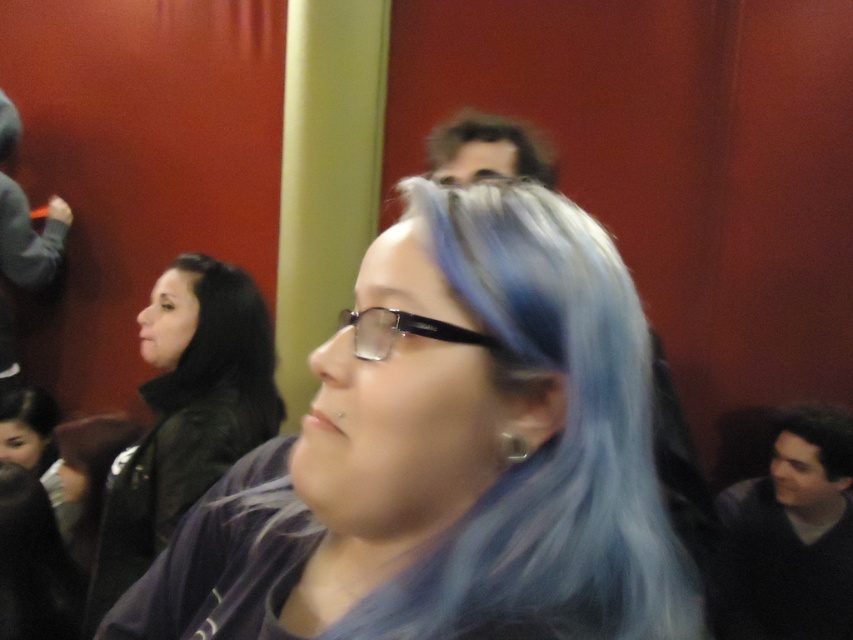
Question: Which object is positioned farthest from the dark brown hair at upper center?

Choices:
 (A) dark gray sweater at center
 (B) black plastic glasses at center
 (C) black leather jacket at upper left
 (D) semi-glossy blue hair at center

Answer: (A)

Question: Which point is closer to the camera taking this photo?

Choices:
 (A) (405, 314)
 (B) (247, 321)
 (C) (538, 179)

Answer: (A)

Question: Among these points, which one is nearest to the camera?

Choices:
 (A) (569, 288)
 (B) (144, 540)
 (C) (407, 323)

Answer: (C)

Question: Is semi-glossy blue hair at center to the right of dark gray sweater at center from the viewer's perspective?

Choices:
 (A) yes
 (B) no

Answer: (B)

Question: Does black leather jacket at upper left have a greater width compared to dark brown hair at upper center?

Choices:
 (A) no
 (B) yes

Answer: (B)

Question: From the image, what is the correct spatial relationship of black leather jacket at upper left in relation to black plastic glasses at center?

Choices:
 (A) right
 (B) left

Answer: (B)